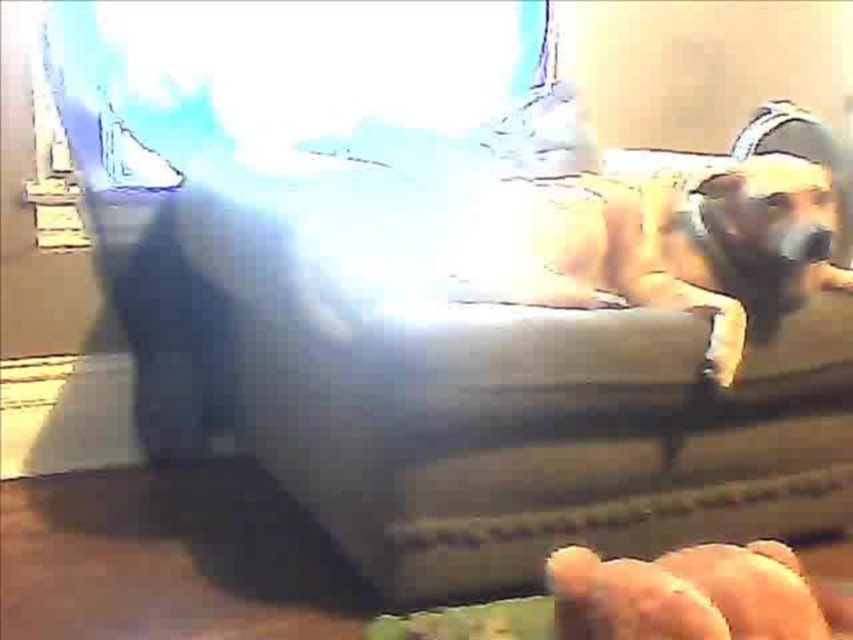
You are standing in a room and see a point marked at coordinates (666, 244). According to the image, what object is located at that point?

The point at coordinates (666, 244) corresponds to the furry beige dog at center.

You are a photographer trying to capture a close up of the furry beige dog at center and the smooth leather hand at lower right. Since the lighting is harsh, you want to adjust your camera to focus on the subject that is closer to the camera. Which object is closer to the camera?

The smooth leather hand at lower right is closer to the camera because the furry beige dog at center is to the right of it, implying spatial positioning that the hand is in front.

You are a dog trainer observing a dog and a hand in the image. The dog is at the center and the hand is at the lower right. You need to determine if the hand is within a safe distance to approach the dog without causing stress. The recommended safe distance for an unfamiliar dog is 30 inches. Can the smooth leather hand at lower right approach the furry beige dog at center safely?

The distance between the furry beige dog at center and the smooth leather hand at lower right is 26.31 inches, which is less than the recommended 30 inches safe distance. Therefore, the hand should not approach closer to avoid stressing the furry beige dog at center.